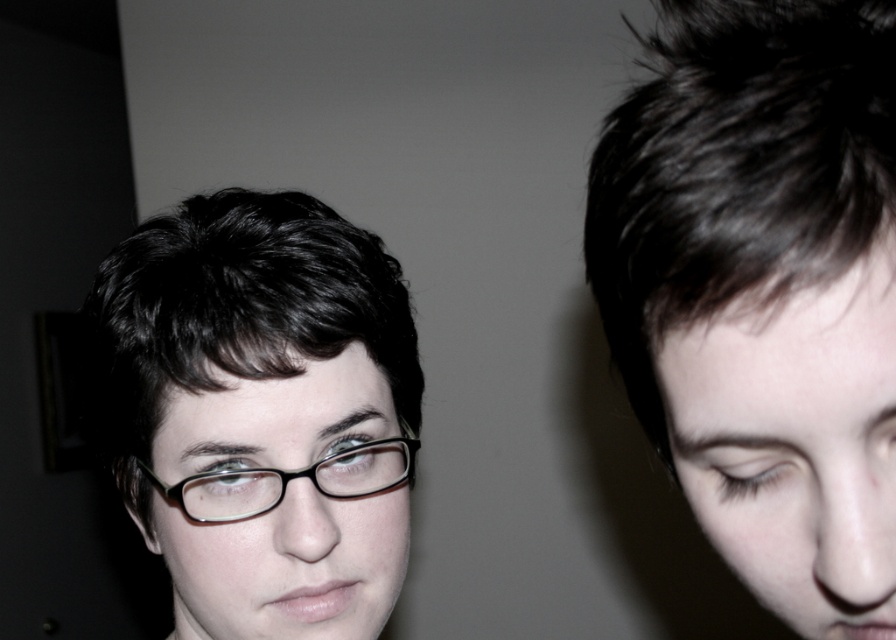
Question: Which of the following is the farthest from the observer?

Choices:
 (A) black plastic glasses at center
 (B) matte black glasses at left
 (C) dark brown hair at upper right

Answer: (A)

Question: Which point appears farthest from the camera in this image?

Choices:
 (A) 383,506
 (B) 376,477
 (C) 782,42

Answer: (B)

Question: Which object appears farthest from the camera in this image?

Choices:
 (A) matte black glasses at left
 (B) dark brown hair at upper right

Answer: (A)

Question: Can you confirm if dark brown hair at upper right is bigger than black plastic glasses at center?

Choices:
 (A) yes
 (B) no

Answer: (A)

Question: Is dark brown hair at upper right positioned at the back of black plastic glasses at center?

Choices:
 (A) no
 (B) yes

Answer: (A)

Question: Is dark brown hair at upper right behind black plastic glasses at center?

Choices:
 (A) yes
 (B) no

Answer: (B)